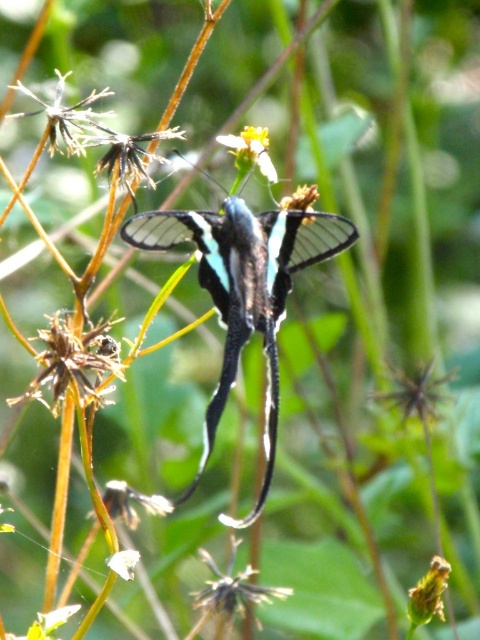
You are an entomologist observing a butterfly. The butterfly is at point (x=244, y=289). You need to place a small net to catch it without disturbing the plant. Where should you position the net relative to the butterfly?

The translucent glass butterfly at center is located at point (x=244, y=289). To catch it without disturbing the plant, position the net directly beneath the butterfly at that point.

You are a gardener observing a butterfly on a plant. You notice two flowers in the scene. The green matte flower at lower right and the yellow matte flower at center. Which flower is positioned lower in the image?

The green matte flower at lower right is positioned lower in the image than the yellow matte flower at center.

You are a gardener who wants to water the green matte flower at lower right and the yellow matte flower at center. Which one should you water first if you want to start with the one closest to you?

The green matte flower at lower right is closer to the viewer than the yellow matte flower at center, so you should water the green matte flower at lower right first.